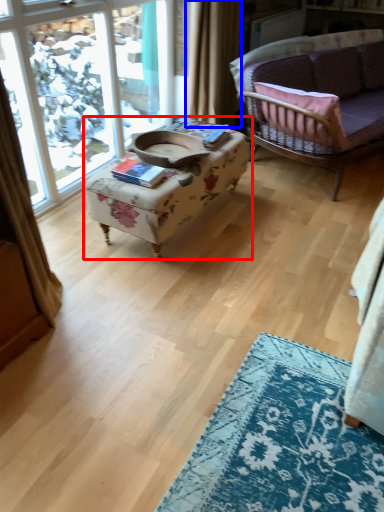
Question: Which point is closer to the camera, table (highlighted by a red box) or curtain (highlighted by a blue box)?

Choices:
 (A) table
 (B) curtain

Answer: (A)